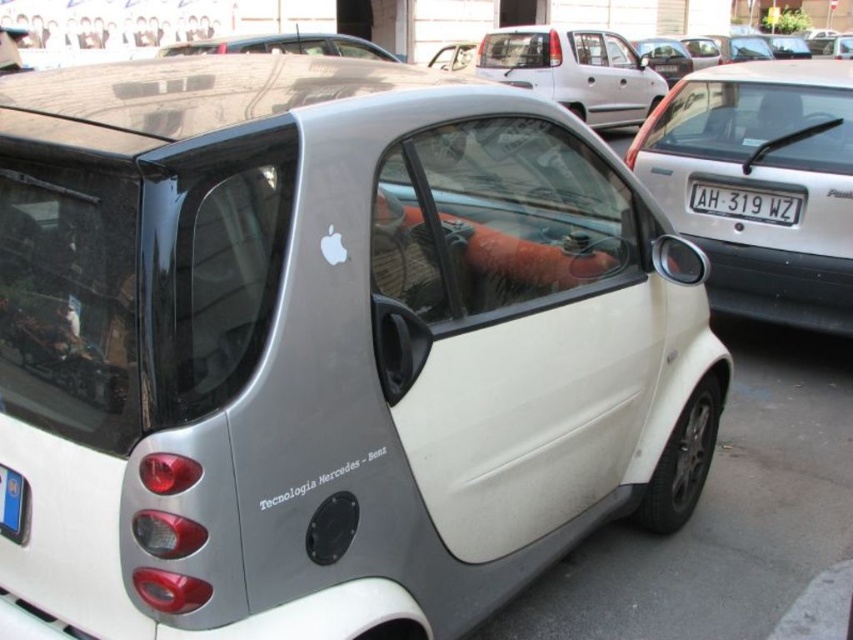
You are a delivery person trying to attach a package to the roof of the silver metallic car at center. The package requires a secure attachment point that is at least 25 centimeters away from the white plastic license plate at center. Can you attach the package directly above the license plate?

The silver metallic car at center and white plastic license plate at center are 23.09 centimeters apart. Since the required distance is 25 centimeters, the package cannot be attached directly above the license plate as it does not meet the minimum distance requirement.

You are a delivery person trying to deliver a package to the silver metallic car at upper center. The package is designed to fit on the white plastic license plate at center. Will the package fit on the license plate?

The silver metallic car at upper center has a smaller size compared to the white plastic license plate at center, so the package designed for the license plate will fit on it.

You are a photographer standing in front of the silver car with the Apple logo. You want to take a photo that includes both the point at coordinates point (160,54) and point (775,218). Which point is closer to your camera?

Point (160,54) is further to the camera than point (775,218). Wait, no, the description says the opposite. Let me check again. The Objects Description states that point (160,54) is further to the camera than point (775,218). So the answer should be that point (160,54) is farther away, so the closer one is point (775,218). Hmm, but the user wants the question to ask which is closer. Let me rephrase the answer correctly. The answer should state that point (160,54) is further away, so